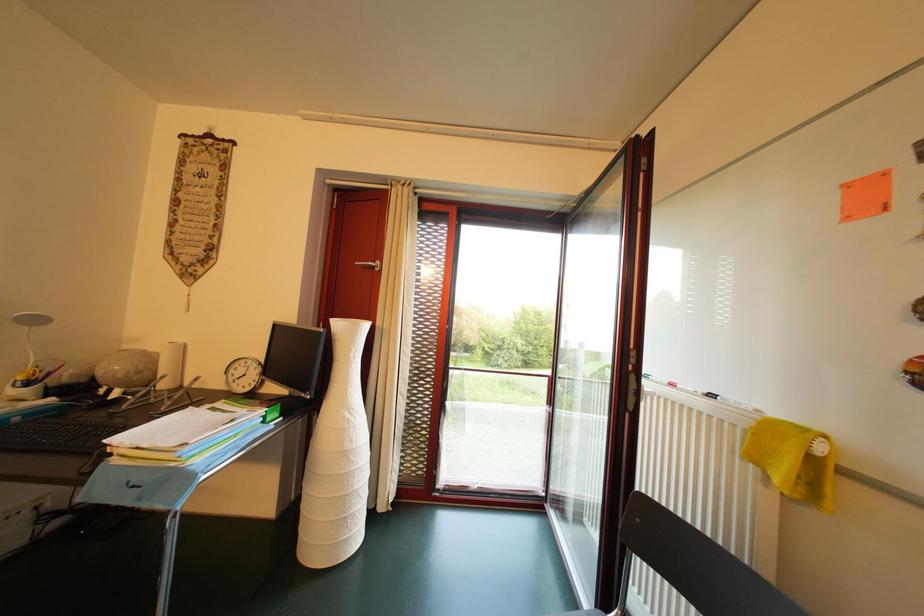
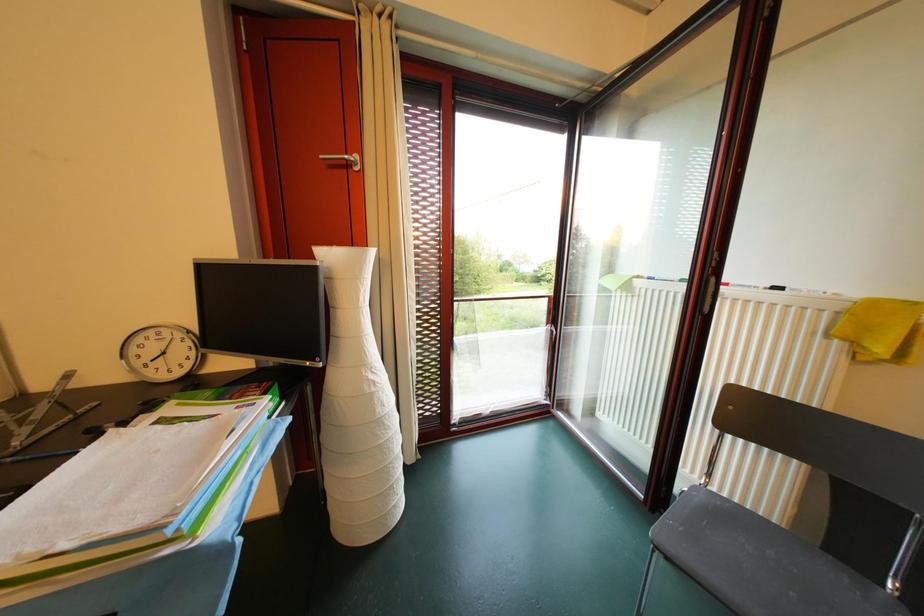
In a continuous first-person perspective shot, in which direction is the camera moving?

The movement direction of the cameraman is left, forward.